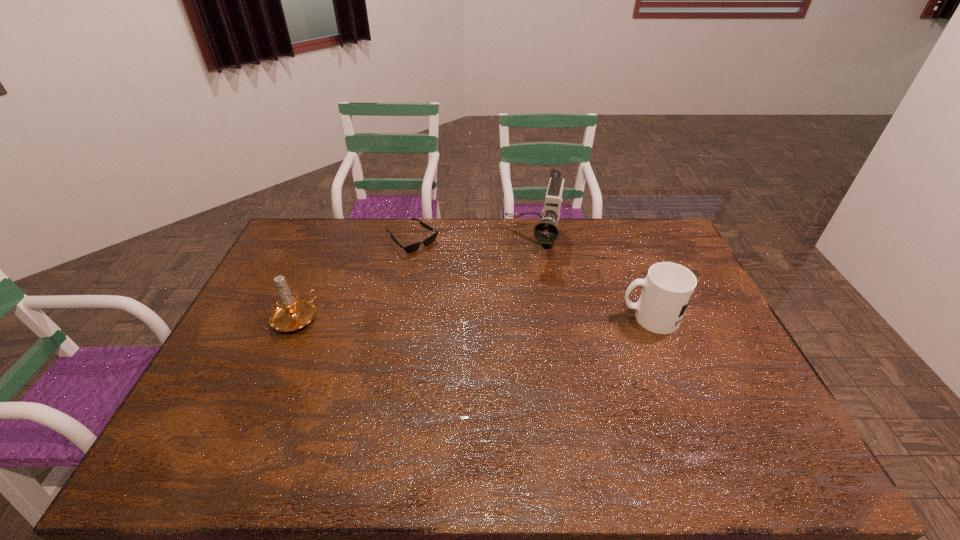
At what (x,y) coordinates should I click in order to perform the action: click on free location at the far edge of the desktop. Please return your answer as a coordinate pair (x, y). Looking at the image, I should click on (461, 228).

Locate an element on the screen. The height and width of the screenshot is (540, 960). vacant space at the near edge of the desktop is located at coordinates (685, 426).

In the image, there is a desktop. Where is `free region at the left edge`? This screenshot has height=540, width=960. free region at the left edge is located at coordinates (255, 364).

The width and height of the screenshot is (960, 540). In the image, there is a desktop. What are the coordinates of `vacant area at the far left corner` in the screenshot? It's located at (323, 227).

Where is `vacant point located between the sunglasses and the candle`? The image size is (960, 540). vacant point located between the sunglasses and the candle is located at coordinates 354,279.

Identify the location of free space between the second object from right to left and the mug. The height and width of the screenshot is (540, 960). (591, 282).

Find the location of a particular element. The image size is (960, 540). empty space between the tallest object and the leftmost object is located at coordinates (415, 282).

At what (x,y) coordinates should I click in order to perform the action: click on free space between the candle and the rightmost object. Please return your answer as a coordinate pair (x, y). The width and height of the screenshot is (960, 540). Looking at the image, I should click on (472, 318).

At what (x,y) coordinates should I click in order to perform the action: click on vacant point located between the leftmost object and the camcorder. Please return your answer as a coordinate pair (x, y). Looking at the image, I should click on (415, 282).

Identify the location of empty space between the tallest object and the candle. The image size is (960, 540). click(415, 282).